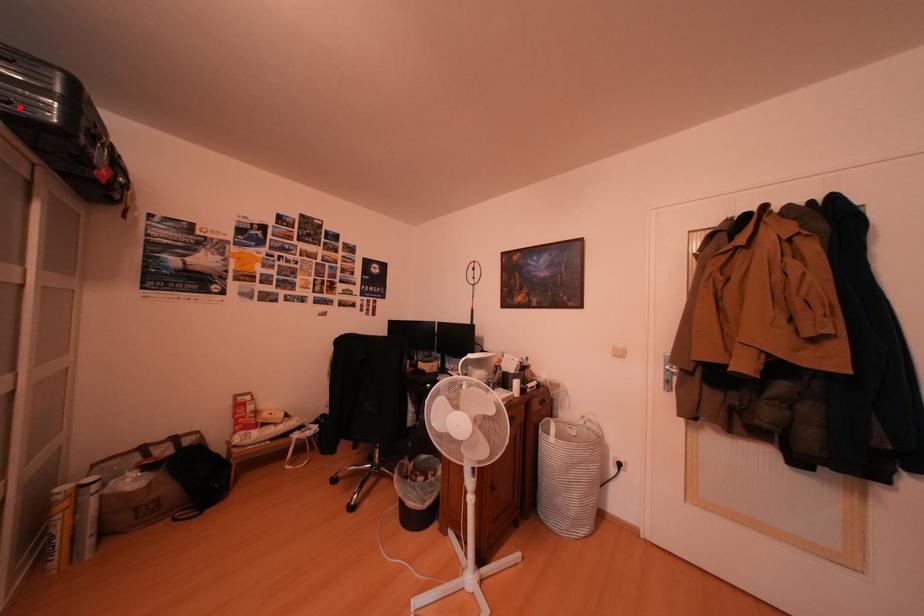
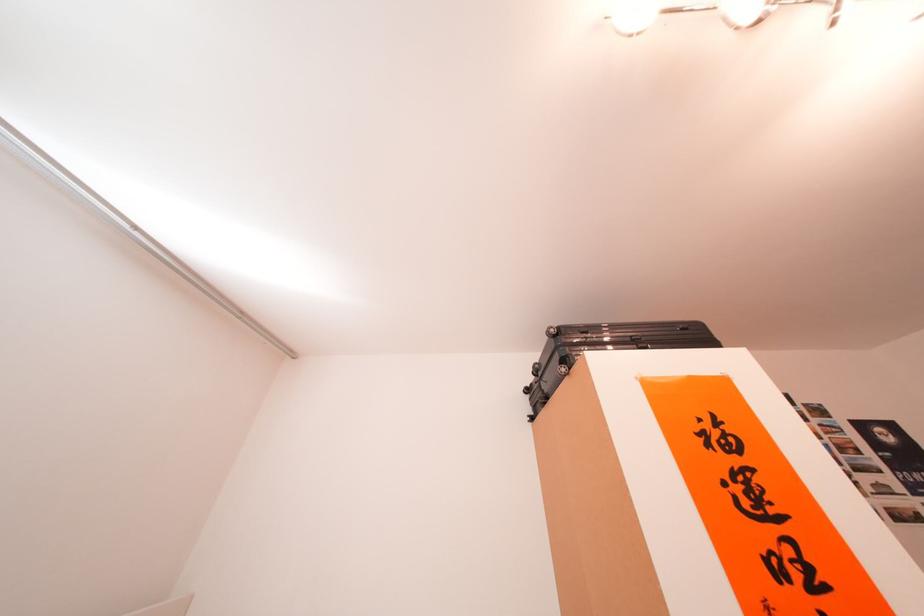
Question: I am providing you with two images of the same scene from different viewpoints. A red point is marked on the first image. At the location where the point appears in image 1, is it still visible in image 2?

Choices:
 (A) Yes
 (B) No

Answer: (B)